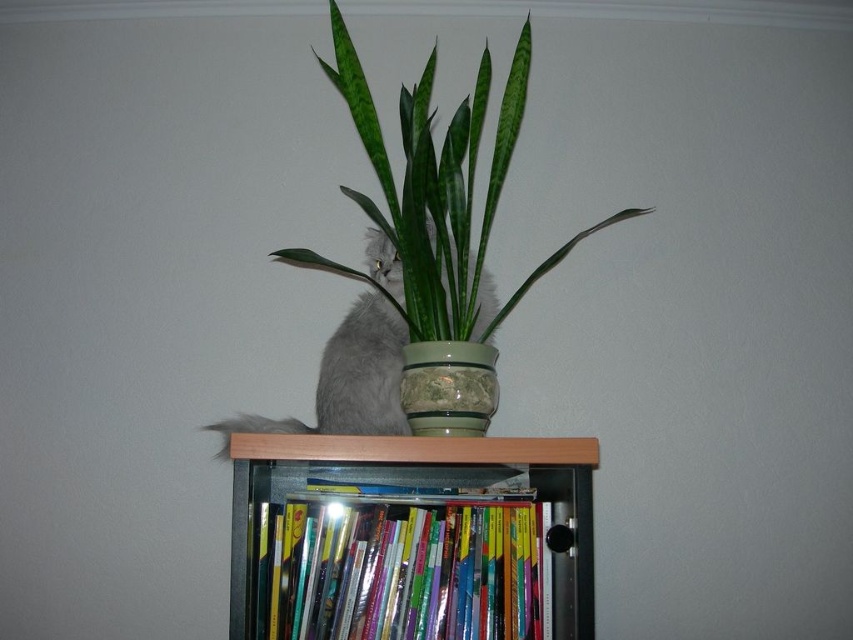
Consider the image. You are standing in front of the bookshelf and notice two points marked on the image. From your perspective, which point is closer to you, point (450,184) or point (422,442)?

Point (422,442) is closer to you because the Objects Description states that point (450,184) is behind point (422,442).

You are standing in front of the bookshelf and see two points marked on it. Which point is closer to you, point [495,444] or point [485,288]?

Point [495,444] is in front of point [485,288], so it is closer to you.

You are a small toy mouse that is 10 centimeters long. You want to move from the translucent plastic bookcase at center to the fluffy gray cat at center. Can you fit through the space between them without getting stuck?

The translucent plastic bookcase at center is 18.41 centimeters away from the fluffy gray cat at center. Since the toy mouse is only 10 centimeters long, there is enough space for it to move between them without getting stuck.